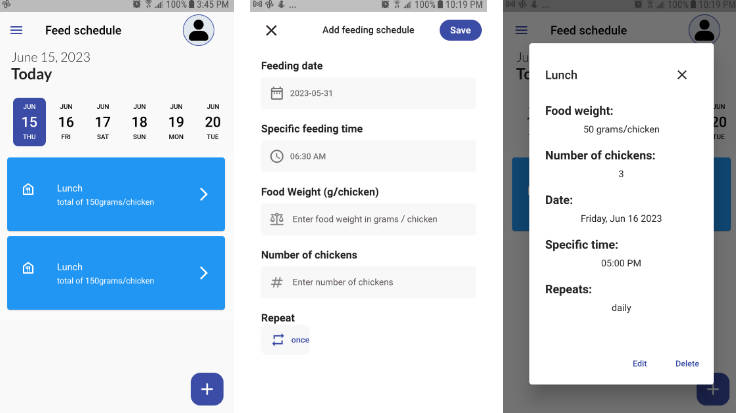
The height and width of the screenshot is (413, 736). I want to click on alarm, so click(382, 0), click(135, 0).